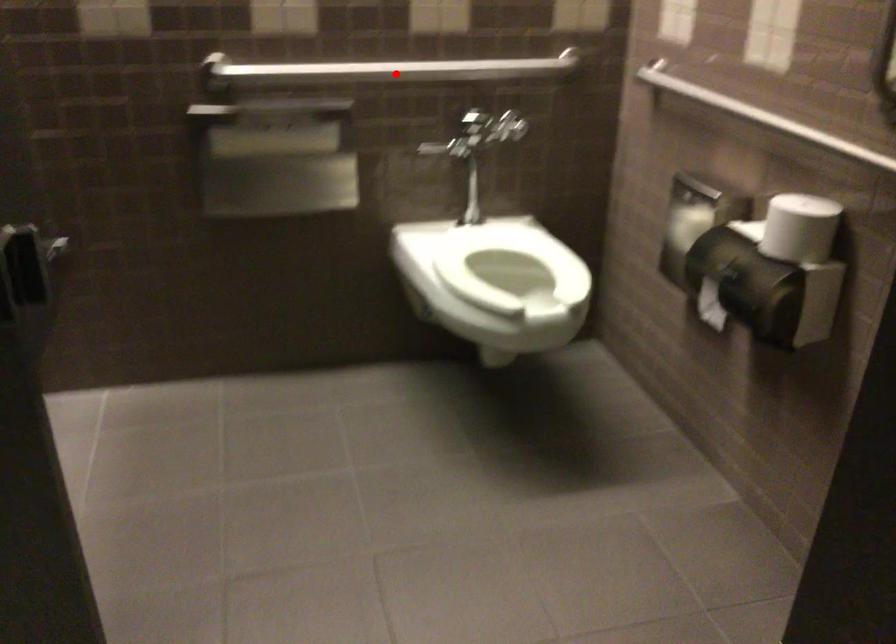
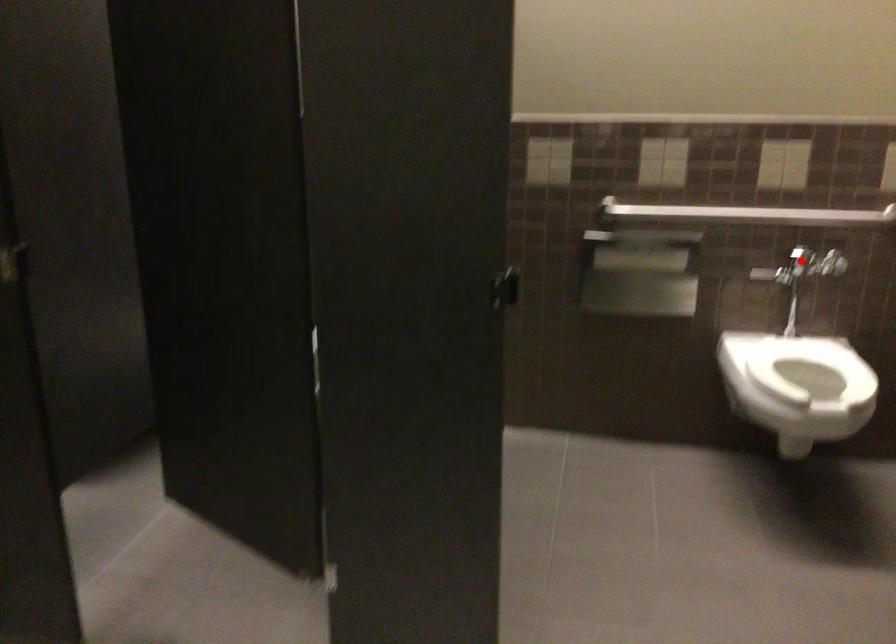
Based on the photo, I am providing you with two images of the same scene from different viewpoints. A red point is marked on the first image and another point is marked on the second image. Is the marked point in image1 the same physical position as the marked point in image2?

No